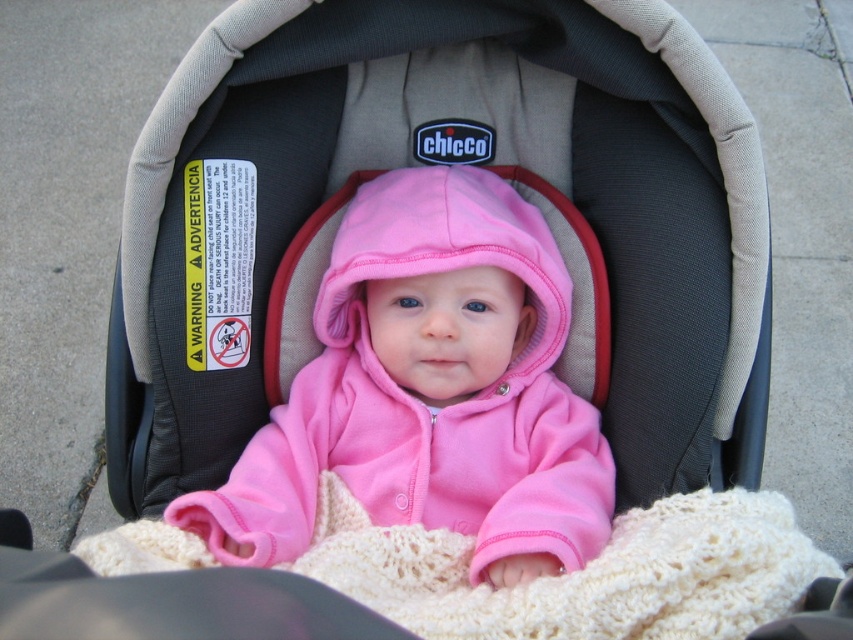
Who is positioned more to the left, pink fleece baby at center or creamy knit blanket at center?

Positioned to the left is pink fleece baby at center.

From the picture: Does pink fleece baby at center have a greater width compared to creamy knit blanket at center?

No.

What are the coordinates of `pink fleece baby at center` in the screenshot? It's located at (428, 390).